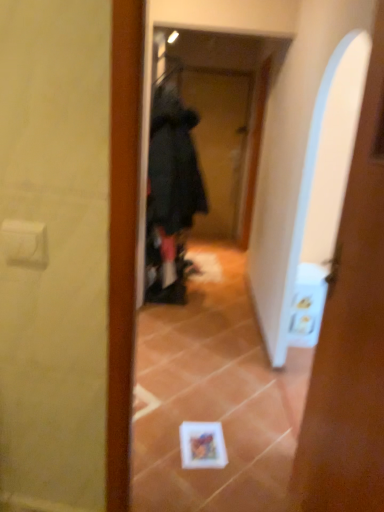
What do you see at coordinates (218, 143) in the screenshot? I see `black fabric screen door at center` at bounding box center [218, 143].

In order to click on black fuzzy bathrobe at center in this screenshot , I will do `click(173, 165)`.

Considering the relative sizes of white glossy door at center and black fuzzy bathrobe at center in the image provided, is white glossy door at center taller than black fuzzy bathrobe at center?

Correct, white glossy door at center is much taller as black fuzzy bathrobe at center.

In the scene shown: Can you tell me how much white glossy door at center and black fuzzy bathrobe at center differ in facing direction?

The angle between the facing direction of white glossy door at center and the facing direction of black fuzzy bathrobe at center is 86 degrees.

Considering the relative sizes of white glossy door at center and black fuzzy bathrobe at center in the image provided, is white glossy door at center bigger than black fuzzy bathrobe at center?

Actually, white glossy door at center might be smaller than black fuzzy bathrobe at center.

Which object is positioned more to the right, white glossy door at center or black fuzzy bathrobe at center?

white glossy door at center is more to the right.

Which object is further away from the camera, black fabric screen door at center or black fuzzy bathrobe at center?

black fabric screen door at center is behind.

Considering the relative sizes of black fabric screen door at center and black fuzzy bathrobe at center in the image provided, is black fabric screen door at center bigger than black fuzzy bathrobe at center?

No, black fabric screen door at center is not bigger than black fuzzy bathrobe at center.

Considering the points (220, 81) and (156, 109), which point is in front, point (220, 81) or point (156, 109)?

Point (156, 109)

Is black fabric screen door at center in front of or behind white glossy door at center in the image?

black fabric screen door at center is behind white glossy door at center.

Consider the image. Can you confirm if black fabric screen door at center is positioned to the left of white glossy door at center?

Yes, black fabric screen door at center is to the left of white glossy door at center.

How many degrees apart are the facing directions of black fabric screen door at center and white glossy door at center?

There is a 90.1-degree angle between the facing directions of black fabric screen door at center and white glossy door at center.

This screenshot has height=512, width=384. In the image, there is a white glossy door at center. What are the coordinates of `screen door above it (from the image's perspective)` in the screenshot? It's located at 218,143.

From a real-world perspective, is black fuzzy bathrobe at center located beneath white glossy door at center?

No, from a real-world perspective, black fuzzy bathrobe at center is not beneath white glossy door at center.

I want to click on bathrobe lying above the white glossy door at center (from the image's perspective), so click(173, 165).

From the picture: Considering the relative sizes of black fuzzy bathrobe at center and white glossy door at center in the image provided, is black fuzzy bathrobe at center wider than white glossy door at center?

Yes, black fuzzy bathrobe at center is wider than white glossy door at center.

This screenshot has height=512, width=384. Find the location of `screen door behind the black fuzzy bathrobe at center`. screen door behind the black fuzzy bathrobe at center is located at coordinates (218, 143).

Who is taller, black fuzzy bathrobe at center or black fabric screen door at center?

With more height is black fabric screen door at center.

Between black fuzzy bathrobe at center and black fabric screen door at center, which one appears on the left side from the viewer's perspective?

From the viewer's perspective, black fuzzy bathrobe at center appears more on the left side.

Is black fabric screen door at center a part of white glossy door at center?

No, black fabric screen door at center is located outside of white glossy door at center.

Is white glossy door at center touching black fabric screen door at center?

No, white glossy door at center is not with black fabric screen door at center.

From a real-world perspective, who is located lower, white glossy door at center or black fabric screen door at center?

From a 3D spatial view, white glossy door at center is below.

Identify the location of bathrobe above the white glossy door at center (from a real-world perspective). The image size is (384, 512). (173, 165).

Where is `bathrobe on the left side of black fabric screen door at center`? bathrobe on the left side of black fabric screen door at center is located at coordinates (173, 165).

Considering their positions, is black fuzzy bathrobe at center positioned further to white glossy door at center than black fabric screen door at center?

The object further to white glossy door at center is black fabric screen door at center.

From the image, which object appears to be nearer to black fuzzy bathrobe at center, white glossy door at center or black fabric screen door at center?

white glossy door at center.

Considering their positions, is black fuzzy bathrobe at center positioned closer to black fabric screen door at center than white glossy door at center?

black fuzzy bathrobe at center is closer to black fabric screen door at center.

Based on their spatial positions, is black fabric screen door at center or black fuzzy bathrobe at center closer to white glossy door at center?

black fuzzy bathrobe at center is closer to white glossy door at center.

Which object lies further to the anchor point black fuzzy bathrobe at center, black fabric screen door at center or white glossy door at center?

→ black fabric screen door at center.

Which object lies nearer to the anchor point black fabric screen door at center, white glossy door at center or black fuzzy bathrobe at center?

black fuzzy bathrobe at center is positioned closer to the anchor black fabric screen door at center.

The image size is (384, 512). What are the coordinates of `bathrobe located between white glossy door at center and black fabric screen door at center in the depth direction` in the screenshot? It's located at (173, 165).